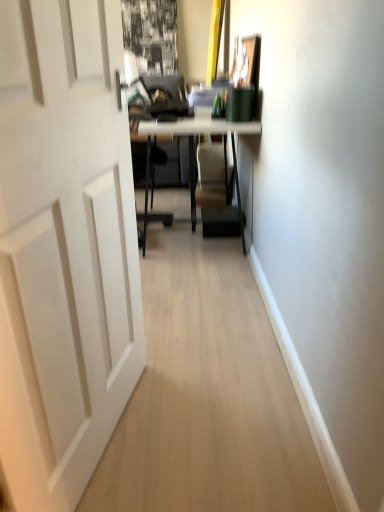
Describe the element at coordinates (194, 150) in the screenshot. Image resolution: width=384 pixels, height=512 pixels. I see `matte white table at center` at that location.

Measure the distance between matte white table at center and camera.

6.82 feet.

Locate an element on the screen. The height and width of the screenshot is (512, 384). matte white table at center is located at coordinates (194, 150).

The image size is (384, 512). What do you see at coordinates (64, 247) in the screenshot?
I see `white matte door at left` at bounding box center [64, 247].

The width and height of the screenshot is (384, 512). I want to click on white matte door at left, so click(x=64, y=247).

You are a GUI agent. You are given a task and a screenshot of the screen. Output one action in this format:
    pyautogui.click(x=<x>, y=<y>)
    Task: Click on the matte white table at center
    
    Given the screenshot: What is the action you would take?
    pyautogui.click(x=194, y=150)

Is white matte door at left at the left side of matte white table at center?

Correct, you'll find white matte door at left to the left of matte white table at center.

Is white matte door at left positioned in front of matte white table at center?

Yes, white matte door at left is closer to the camera.

Is point (48, 80) behind point (196, 121)?

No, (48, 80) is closer to viewer.

From the image's perspective, is white matte door at left above matte white table at center?

Actually, white matte door at left appears below matte white table at center in the image.

From a real-world perspective, relative to matte white table at center, is white matte door at left vertically above or below?

white matte door at left is situated higher than matte white table at center in the real world.

Which object is thinner, white matte door at left or matte white table at center?

With smaller width is white matte door at left.

Considering the relative sizes of white matte door at left and matte white table at center in the image provided, is white matte door at left taller than matte white table at center?

Yes.

Based on their sizes in the image, would you say white matte door at left is bigger or smaller than matte white table at center?

In the image, white matte door at left appears to be smaller than matte white table at center.

Is white matte door at left not within matte white table at center?

Yes, white matte door at left is located beyond the bounds of matte white table at center.

Is white matte door at left in contact with matte white table at center?

white matte door at left and matte white table at center are not in contact.

Is white matte door at left oriented away from matte white table at center?

No.

Identify the location of door above the matte white table at center (from a real-world perspective). (64, 247).

Does matte white table at center appear on the right side of white matte door at left?

Correct, you'll find matte white table at center to the right of white matte door at left.

Is matte white table at center in front of or behind white matte door at left in the image?

matte white table at center is behind white matte door at left.

Is point (147, 220) more distant than point (79, 455)?

Yes.

From the image's perspective, which one is positioned lower, matte white table at center or white matte door at left?

white matte door at left appears lower in the image.

From a real-world perspective, which is physically above, matte white table at center or white matte door at left?

white matte door at left, from a real-world perspective.

Can you confirm if matte white table at center is wider than white matte door at left?

Correct, the width of matte white table at center exceeds that of white matte door at left.

Considering the sizes of matte white table at center and white matte door at left in the image, is matte white table at center taller or shorter than white matte door at left?

Clearly, matte white table at center is shorter compared to white matte door at left.

Is matte white table at center bigger than white matte door at left?

Correct, matte white table at center is larger in size than white matte door at left.

Is white matte door at left inside matte white table at center?

No.

Is matte white table at center directly adjacent to white matte door at left?

No.

Is matte white table at center oriented towards white matte door at left?

No, matte white table at center is not oriented towards white matte door at left.

Identify the location of table located underneath the white matte door at left (from a real-world perspective). tap(194, 150).

You are a GUI agent. You are given a task and a screenshot of the screen. Output one action in this format:
    pyautogui.click(x=<x>, y=<y>)
    Task: Click on the door below the matte white table at center (from the image's perspective)
    
    Given the screenshot: What is the action you would take?
    pyautogui.click(x=64, y=247)

Where is `table behind the white matte door at left`? The height and width of the screenshot is (512, 384). table behind the white matte door at left is located at coordinates (194, 150).